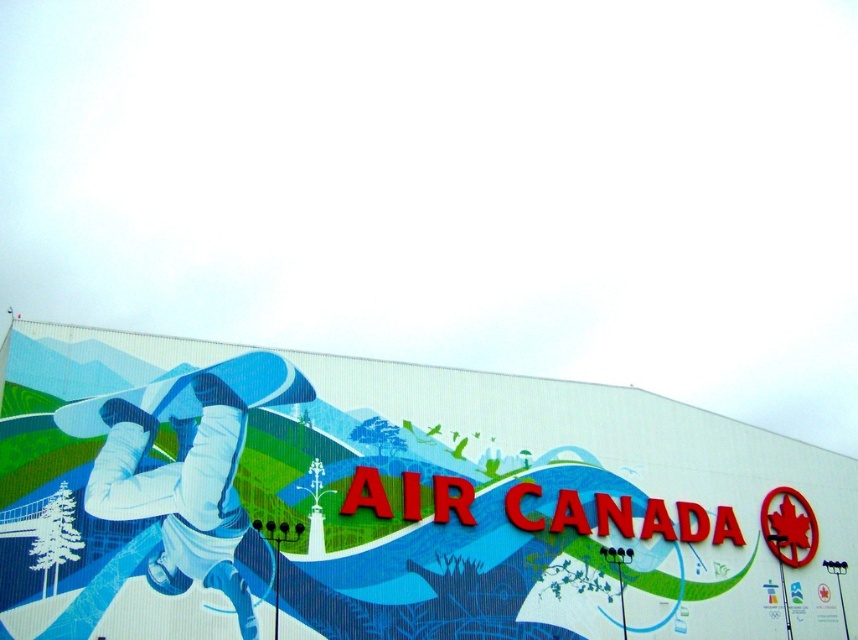
You are taking a photo of the Air Canada mural and want to focus on both the point at point (506, 444) and point (221, 499). Which point should you adjust your camera focus to first to ensure it is closer to you?

Point (221, 499) is closer to you than point (506, 444), so you should adjust your camera focus to point (221, 499) first to ensure it is closer to you.